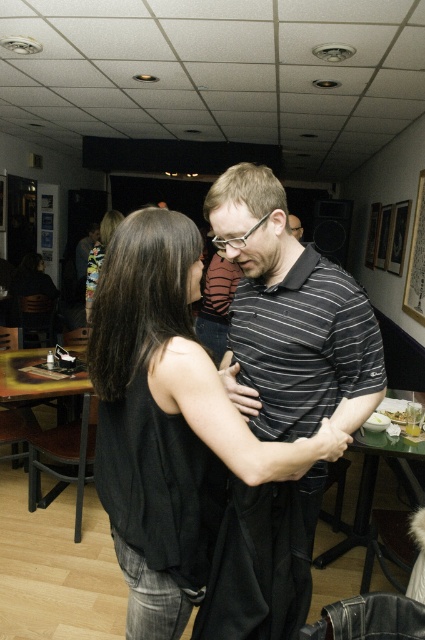
Question: Can you confirm if shiny black hair at center is positioned above striped cotton shirt at center?

Choices:
 (A) no
 (B) yes

Answer: (A)

Question: Is black cotton tank top at center wider than striped cotton shirt at center?

Choices:
 (A) no
 (B) yes

Answer: (B)

Question: Observing the image, what is the correct spatial positioning of black cotton tank top at center in reference to shiny black hair at center?

Choices:
 (A) left
 (B) right

Answer: (B)

Question: Which object is closer to the camera taking this photo?

Choices:
 (A) striped cotton shirt at center
 (B) black cotton tank top at center

Answer: (B)

Question: Which point is closer to the camera?

Choices:
 (A) (282, 636)
 (B) (121, 436)
 (C) (300, 227)

Answer: (B)

Question: Which object is positioned closest to the black cotton tank top at center?

Choices:
 (A) striped cotton polo shirt at center
 (B) striped cotton shirt at center
 (C) shiny black hair at center

Answer: (A)